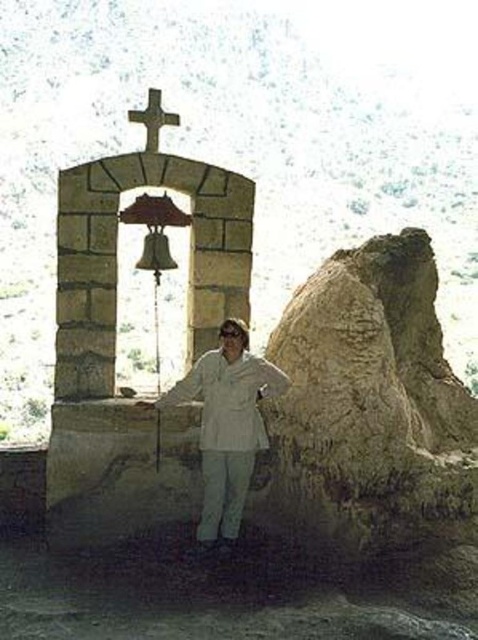
Question: Is white matte jacket at center thinner than metallic cross at upper center?

Choices:
 (A) no
 (B) yes

Answer: (A)

Question: Is white matte jacket at center in front of metallic cross at upper center?

Choices:
 (A) yes
 (B) no

Answer: (A)

Question: Which point appears closest to the camera in this image?

Choices:
 (A) (167, 120)
 (B) (238, 328)

Answer: (B)

Question: Is white matte jacket at center bigger than metallic cross at upper center?

Choices:
 (A) no
 (B) yes

Answer: (B)